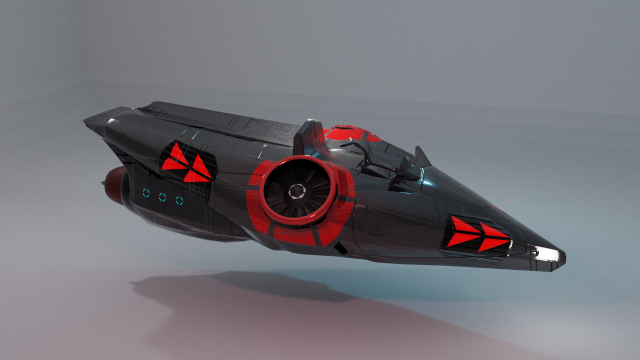
Find the location of a particular element. Image resolution: width=640 pixels, height=360 pixels. light is located at coordinates (425, 182).